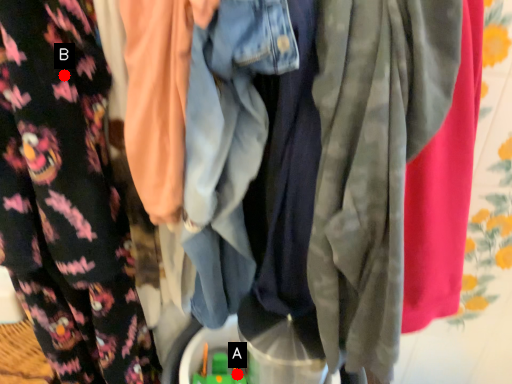
Question: Two points are circled on the image, labeled by A and B beside each circle. Which point is farther to the camera?

Choices:
 (A) A is further
 (B) B is further

Answer: (A)